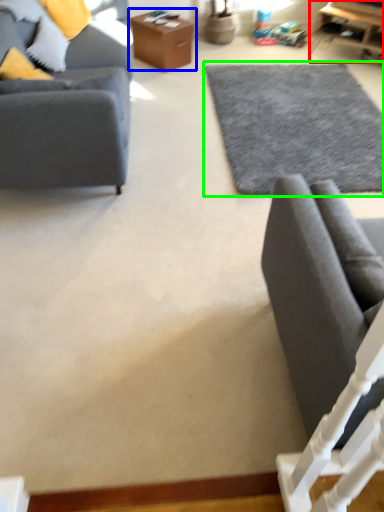
Question: Which object is positioned farthest from table (highlighted by a red box)? Select from table (highlighted by a blue box) and plain (highlighted by a green box).

Choices:
 (A) table
 (B) plain

Answer: (A)